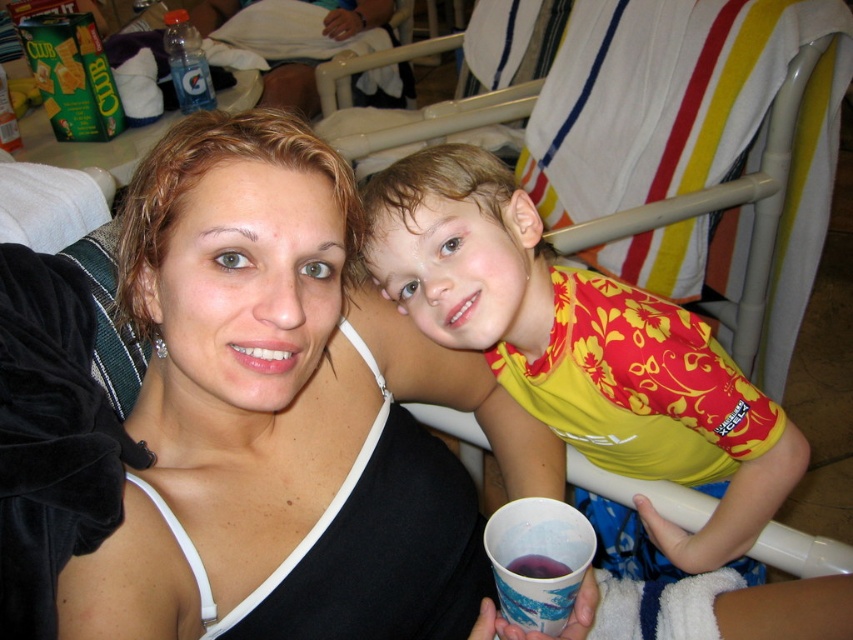
Question: Is yellow floral shirt at upper right to the left of purple matte liquid at cup right from the viewer's perspective?

Choices:
 (A) no
 (B) yes

Answer: (A)

Question: Which point is farther to the camera?

Choices:
 (A) (621, 461)
 (B) (556, 563)
 (C) (556, 609)

Answer: (A)

Question: Is yellow floral shirt at upper right positioned at the back of purple paper cup at lower center?

Choices:
 (A) no
 (B) yes

Answer: (B)

Question: Does purple paper cup at lower center lie behind purple matte liquid at cup right?

Choices:
 (A) yes
 (B) no

Answer: (B)

Question: Which of the following is the farthest from the observer?

Choices:
 (A) (502, 605)
 (B) (479, 346)
 (C) (527, 564)

Answer: (B)

Question: Which object is positioned farthest from the yellow floral shirt at upper right?

Choices:
 (A) purple paper cup at lower center
 (B) purple matte liquid at cup right

Answer: (B)